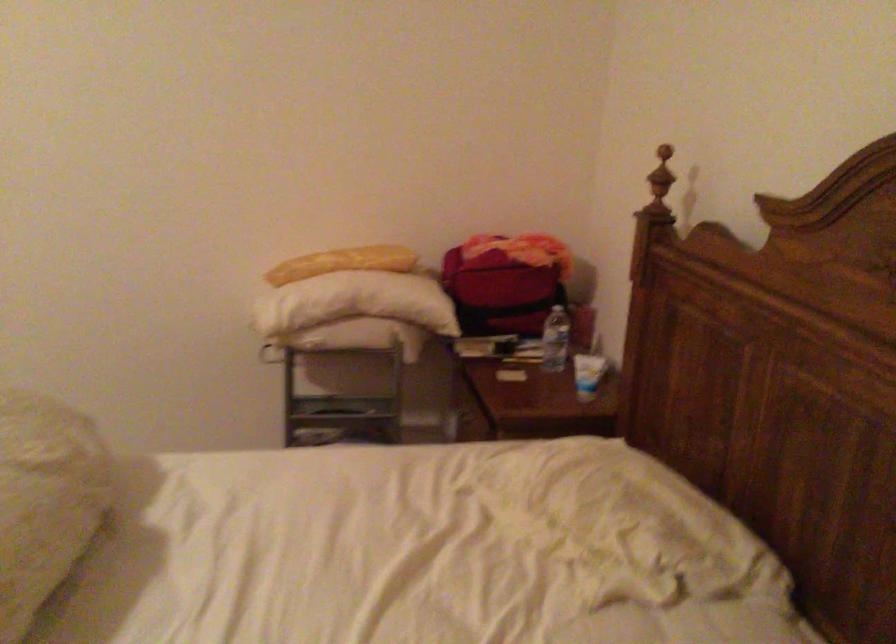
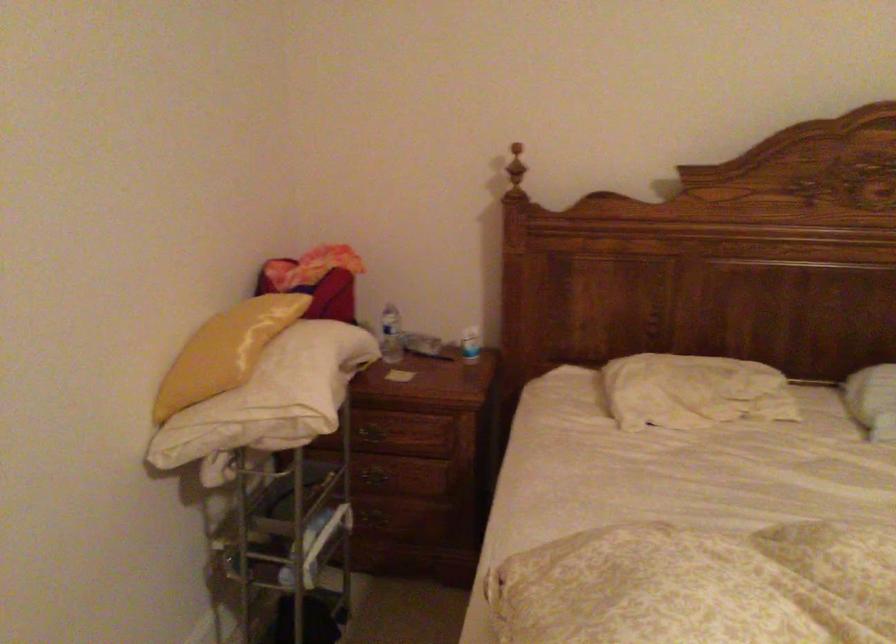
Question: I am providing you with two images of the same scene from different viewpoints. Please identify which objects are invisible in image2.

Choices:
 (A) red bag
 (B) yellow pillow
 (C) plastic water bottle
 (D) yellow package

Answer: (A)